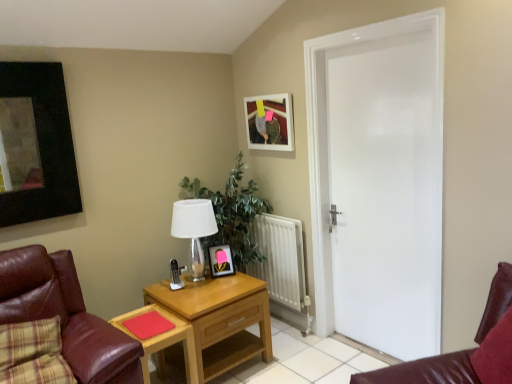
Locate an element on the screen. This screenshot has height=384, width=512. vacant space underneath smooth red paper at lower center (from a real-world perspective) is located at coordinates [150, 322].